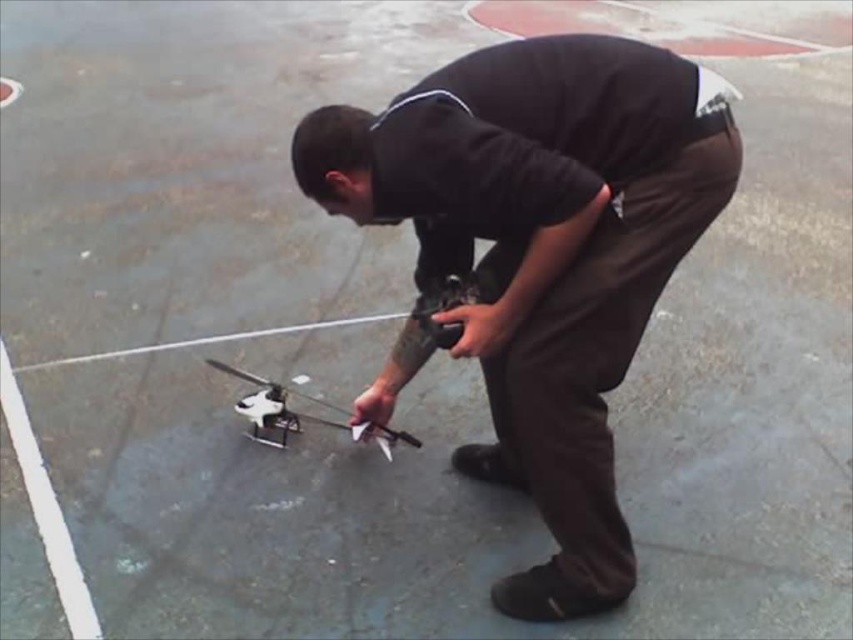
Question: Which of the following is the farthest from the observer?

Choices:
 (A) (715, 177)
 (B) (384, 426)

Answer: (B)

Question: Does black matte remote control at center appear under white matte drone at center?

Choices:
 (A) yes
 (B) no

Answer: (B)

Question: Considering the relative positions of black matte remote control at center and white matte drone at center in the image provided, where is black matte remote control at center located with respect to white matte drone at center?

Choices:
 (A) left
 (B) right

Answer: (B)

Question: Among these points, which one is nearest to the camera?

Choices:
 (A) tap(459, 90)
 (B) tap(300, 416)

Answer: (A)

Question: Is black matte remote control at center positioned behind white matte drone at center?

Choices:
 (A) yes
 (B) no

Answer: (B)